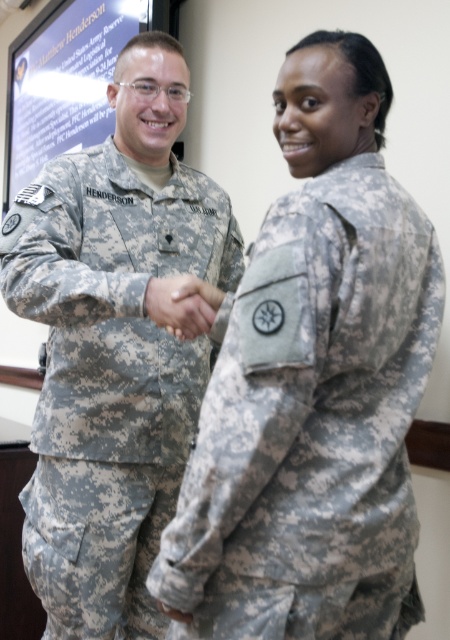
You are a military recruit observing the scene. There is a point at coordinates (113, 346). Which object in the scene does this point correspond to?

The point at coordinates (113, 346) corresponds to the camouflage uniform at left.

You are an observer standing in front of the image. There is a point marked at coordinates point (314, 387). Can you tell me what object is located at that point?

The point (314, 387) corresponds to the camouflage uniform at center.

You are a photographer positioned behind the two military personnel in the scene. You want to capture a closeup shot of their handshake while ensuring both their uniforms are visible in the frame. Given the distance between the camouflage uniform at center and the camouflage fabric hand at center, can you fit both into the camera frame without zooming?

The distance between the camouflage uniform at center and the camouflage fabric hand at center is 15.07 inches. Since the camera frame can typically accommodate objects within this distance when positioned appropriately, you can fit both into the frame without zooming.